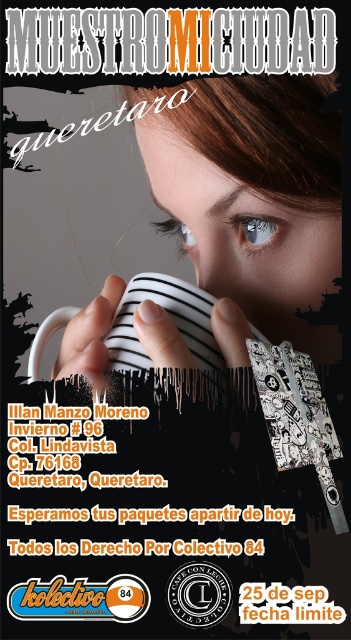
Question: Which point is farther to the camera?

Choices:
 (A) blue glass eye at center
 (B) white striped mug at center

Answer: (A)

Question: Among these points, which one is farthest from the camera?

Choices:
 (A) [68, 307]
 (B) [246, 227]

Answer: (A)

Question: Is the position of blue glass eye at center more distant than that of blue glossy eye at upper center?

Choices:
 (A) no
 (B) yes

Answer: (A)

Question: Is blue glass eye at center to the right of blue glossy eye at upper center from the viewer's perspective?

Choices:
 (A) yes
 (B) no

Answer: (A)

Question: Which point is closer to the camera?

Choices:
 (A) (160, 228)
 (B) (250, 228)

Answer: (B)

Question: Is white striped mug at center wider than blue glass eye at center?

Choices:
 (A) no
 (B) yes

Answer: (B)